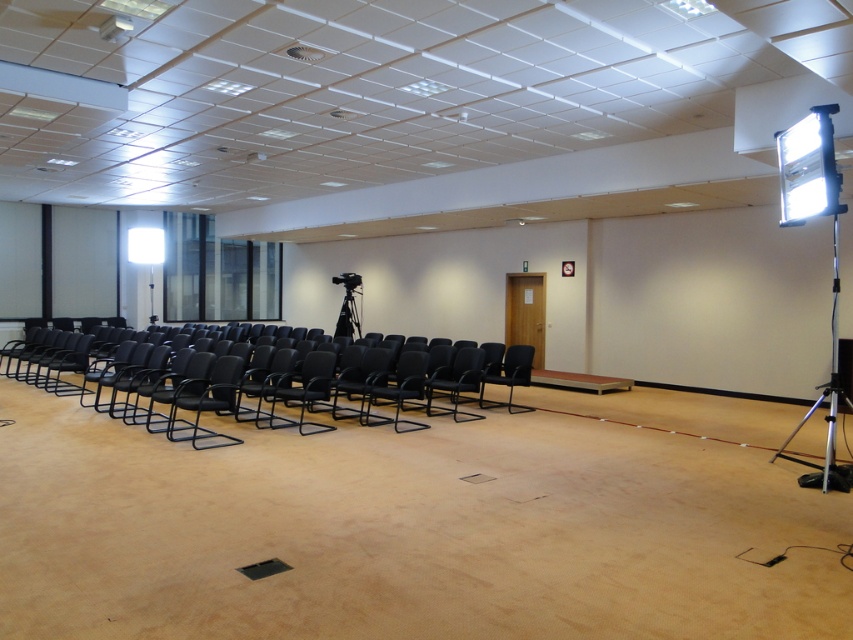
You are a technician who needs to set up a camera in a conference room. The room has a black leather chair at center. If the camera needs to be placed 8 meters away from the chair for optimal focus, is the current placement of the camera sufficient?

The black leather chair at center and camera are 7.97 meters apart from each other, which is just under the required 8 meters. The current placement is almost sufficient but slightly too close for optimal focus.

You are setting up for a presentation and need to adjust the angle of the white glossy projector at upper right and the white plastic projector at upper left. Which projector is positioned lower in the room?

The white glossy projector at upper right is positioned lower in the room than the white plastic projector at upper left because it is below it.

You are setting up for a presentation in the conference room and need to position a screen. The screen must be placed in front of the white glossy projector at upper right to avoid blocking its projection. Based on the room layout described, where should you place the screen relative to the projector?

The screen should be placed in front of the white glossy projector at upper right, ensuring it is positioned where the projection beam can reach without obstruction. Since the projector is at the upper right, the screen should be set up in the lower area facing the projector to receive the projected image.